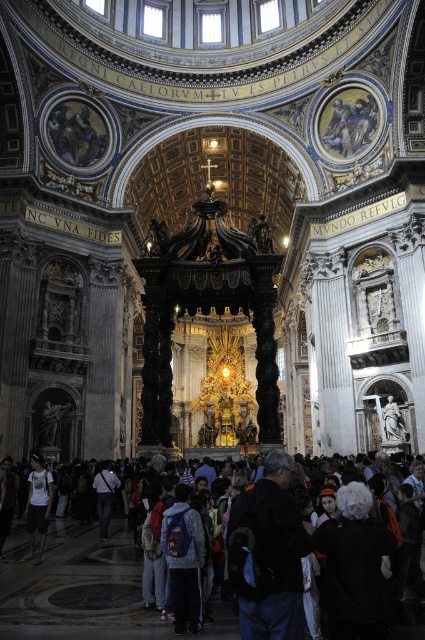
Question: Can you confirm if dark gray hoodie at lower center is smaller than white cotton t-shirt at lower left?

Choices:
 (A) no
 (B) yes

Answer: (B)

Question: Which object is the closest to the denim jacket at lower left?

Choices:
 (A) dark gray hoodie at lower center
 (B) dark clothing crowd at lower center

Answer: (B)

Question: Among these objects, which one is farthest from the camera?

Choices:
 (A) white cotton t-shirt at lower left
 (B) dark gray hoodie at lower center
 (C) denim jacket at lower left
 (D) dark clothing crowd at lower center

Answer: (C)

Question: Where is dark clothing crowd at lower center located in relation to denim jacket at lower left in the image?

Choices:
 (A) above
 (B) below

Answer: (B)

Question: Estimate the real-world distances between objects in this image. Which object is closer to the dark clothing crowd at lower center?

Choices:
 (A) denim jacket at lower left
 (B) white cotton t-shirt at lower left

Answer: (B)

Question: Considering the relative positions of white cotton t-shirt at lower left and denim jacket at lower left in the image provided, where is white cotton t-shirt at lower left located with respect to denim jacket at lower left?

Choices:
 (A) right
 (B) left

Answer: (B)